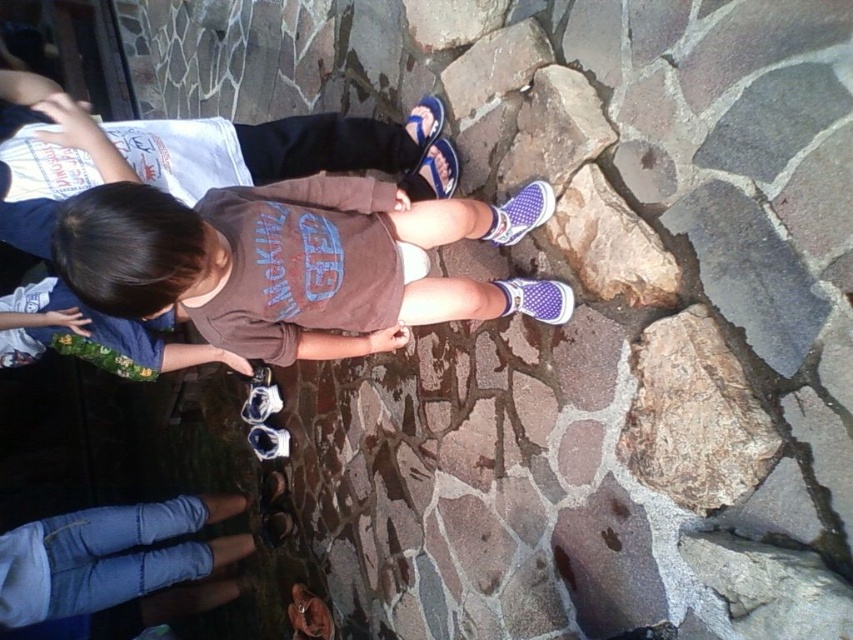
Question: Can you confirm if purple mesh sock at center is positioned below white fabric sock at center?

Choices:
 (A) no
 (B) yes

Answer: (B)

Question: Estimate the real-world distances between objects in this image. Which object is farther from the white fabric sock at center?

Choices:
 (A) brown cotton shirt at center
 (B) purple mesh sock at center

Answer: (A)

Question: Which object appears farthest from the camera in this image?

Choices:
 (A) brown cotton shirt at center
 (B) purple mesh sock at center

Answer: (B)

Question: Among these objects, which one is nearest to the camera?

Choices:
 (A) brown cotton shirt at center
 (B) white fabric sock at center

Answer: (A)

Question: Can you confirm if purple mesh sock at center is positioned to the right of white fabric sock at center?

Choices:
 (A) yes
 (B) no

Answer: (A)

Question: Is brown cotton shirt at center positioned in front of white fabric sock at center?

Choices:
 (A) no
 (B) yes

Answer: (B)